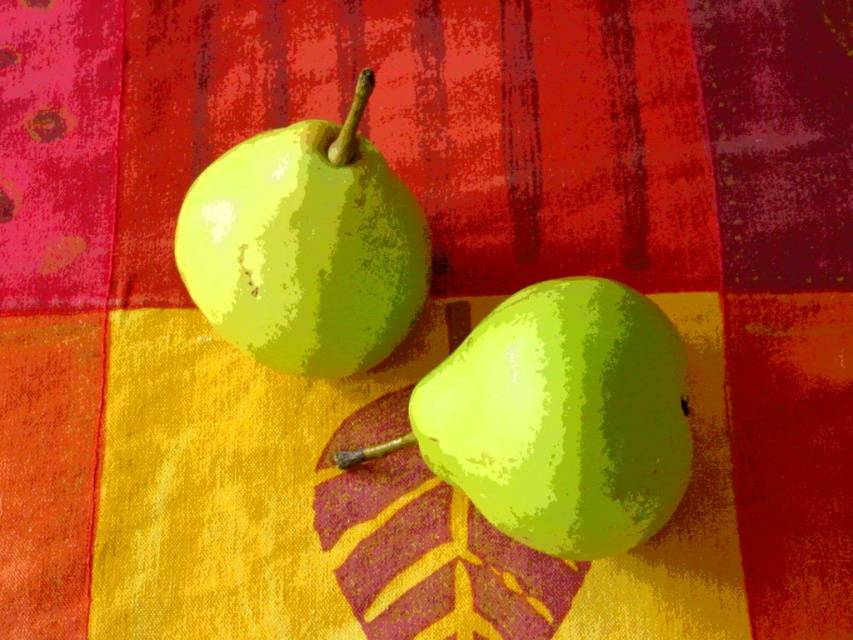
Question: Which point is closer to the camera?

Choices:
 (A) green matte pear at center
 (B) green matte pear at upper left

Answer: (A)

Question: Does green matte pear at center appear under green matte pear at upper left?

Choices:
 (A) yes
 (B) no

Answer: (A)

Question: Does green matte pear at center have a lesser width compared to green matte pear at upper left?

Choices:
 (A) no
 (B) yes

Answer: (A)

Question: Does green matte pear at center have a lesser width compared to green matte pear at upper left?

Choices:
 (A) no
 (B) yes

Answer: (A)